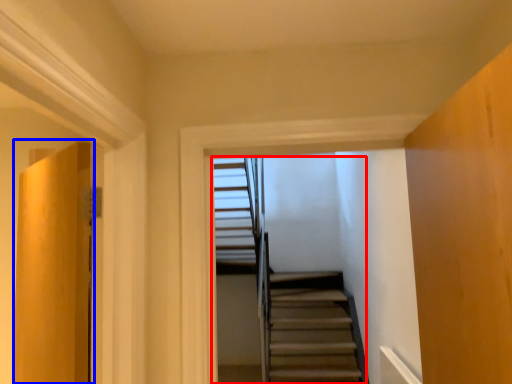
Question: Which object is further to the camera taking this photo, stairs (highlighted by a red box) or door (highlighted by a blue box)?

Choices:
 (A) stairs
 (B) door

Answer: (A)